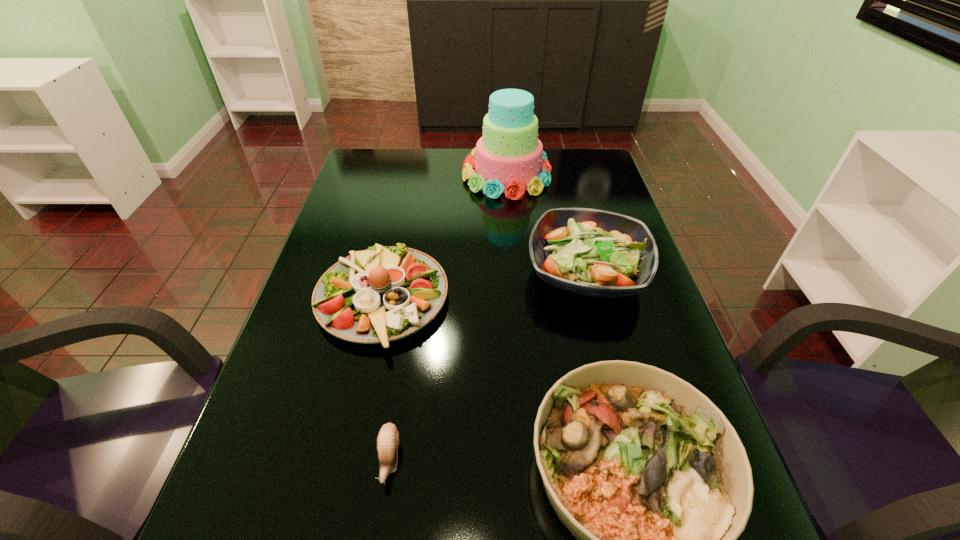
Locate which object ranks in proximity to the escargot. Please provide its 2D coordinates. Your answer should be formatted as a tuple, i.e. [(x, y)], where the tuple contains the x and y coordinates of a point satisfying the conditions above.

[(382, 294)]

This screenshot has height=540, width=960. I want to click on object that stands as the closest to the nearest salad plate, so click(382, 294).

Choose which salad plate is the nearest neighbor to the nearest salad plate. Please provide its 2D coordinates. Your answer should be formatted as a tuple, i.e. [(x, y)], where the tuple contains the x and y coordinates of a point satisfying the conditions above.

[(382, 294)]

Find the location of a particular element. This screenshot has width=960, height=540. salad plate identified as the closest to the tallest salad plate is located at coordinates (642, 468).

In order to click on free region that satisfies the following two spatial constraints: 1. on the back side of the leftmost salad plate; 2. on the left side of the tallest object in this screenshot , I will do `click(410, 174)`.